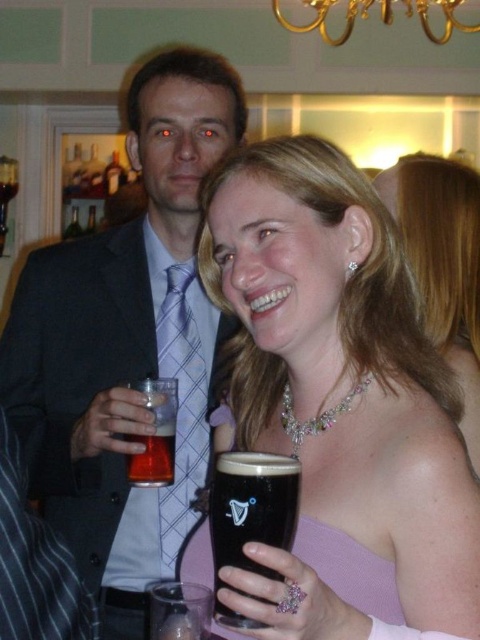
Question: Which object is the farthest from the translucent plastic cup at upper left?

Choices:
 (A) matte purple tie at left
 (B) plaid fabric tie at left
 (C) matte glass beer at center

Answer: (C)

Question: Observing the image, what is the correct spatial positioning of matte glass beer at center in reference to clear glass beer at lower center?

Choices:
 (A) above
 (B) below

Answer: (A)

Question: Which of the following is the farthest from the observer?

Choices:
 (A) (152, 477)
 (B) (173, 614)
 (C) (224, 454)
 (D) (192, 272)

Answer: (D)

Question: Does matte purple tie at left have a greater width compared to translucent plastic cup at upper left?

Choices:
 (A) no
 (B) yes

Answer: (B)

Question: Estimate the real-world distances between objects in this image. Which object is closer to the gold metallic chandelier at upper center?

Choices:
 (A) matte purple tie at left
 (B) translucent plastic cup at upper left

Answer: (A)

Question: Where is dark glass at center located in relation to pearl/sparkling necklace at center in the image?

Choices:
 (A) right
 (B) left

Answer: (B)